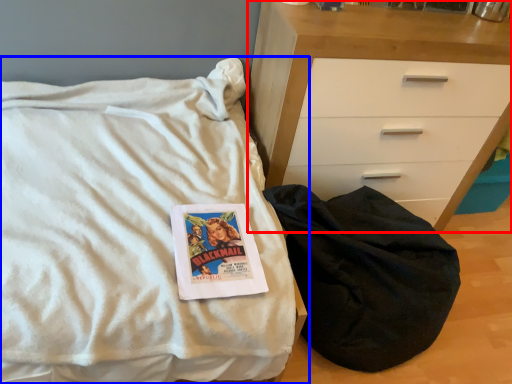
Question: Which of the following is the farthest to the observer, chest of drawers (highlighted by a red box) or bed (highlighted by a blue box)?

Choices:
 (A) chest of drawers
 (B) bed

Answer: (A)